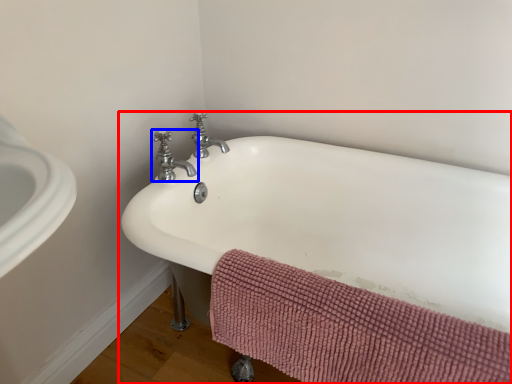
Question: Which object is further to the camera taking this photo, bathtub (highlighted by a red box) or tap (highlighted by a blue box)?

Choices:
 (A) bathtub
 (B) tap

Answer: (B)